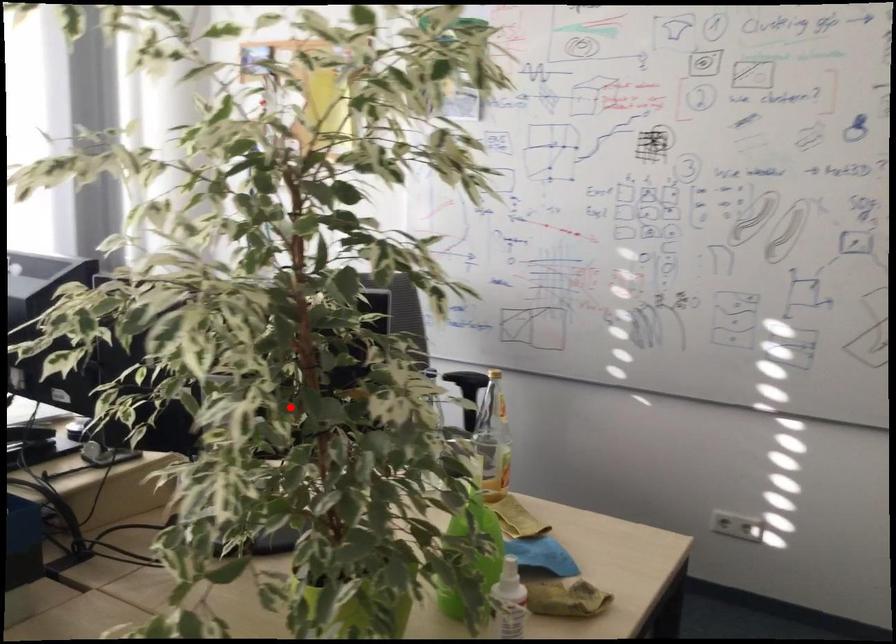
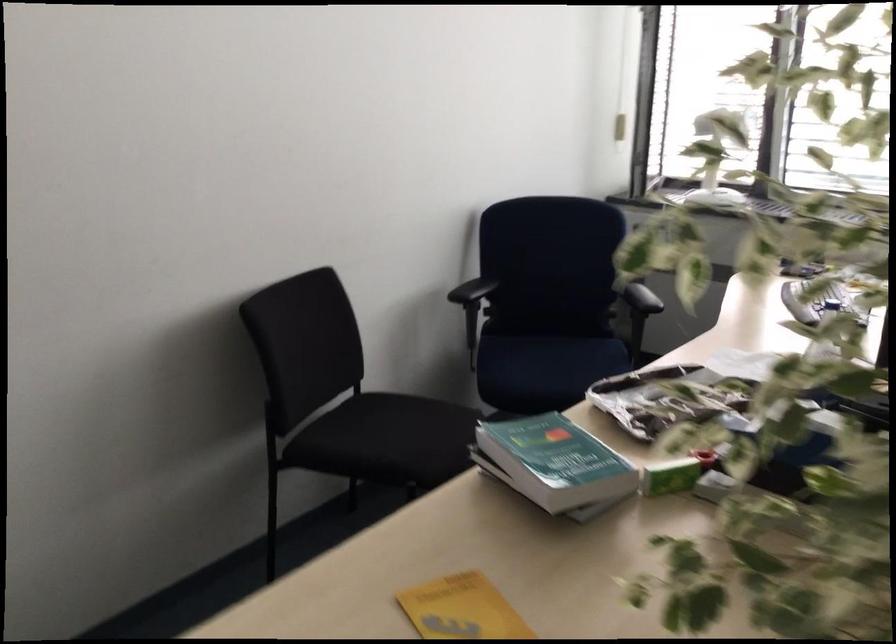
The point at the highlighted location is marked in the first image. Where is the corresponding point in the second image?

(847, 480)